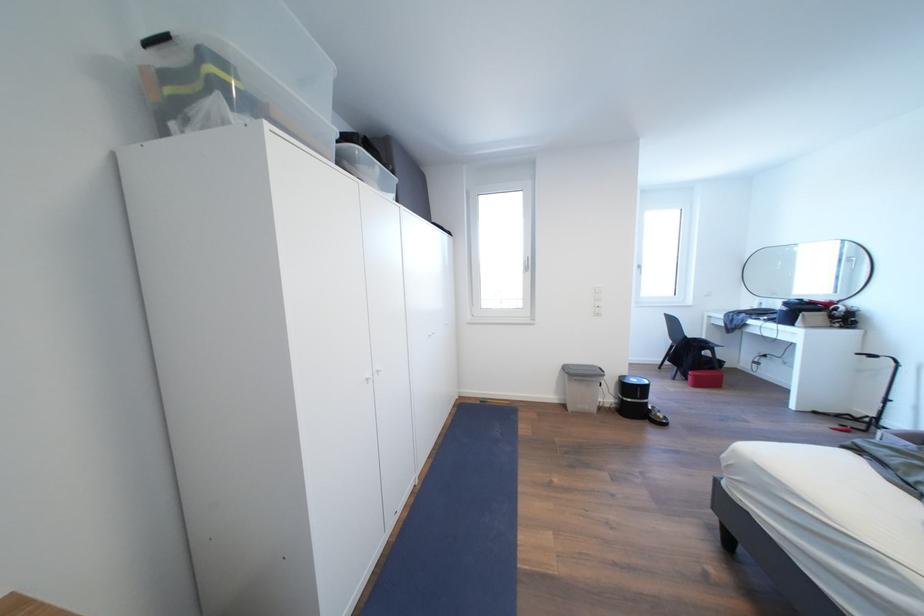
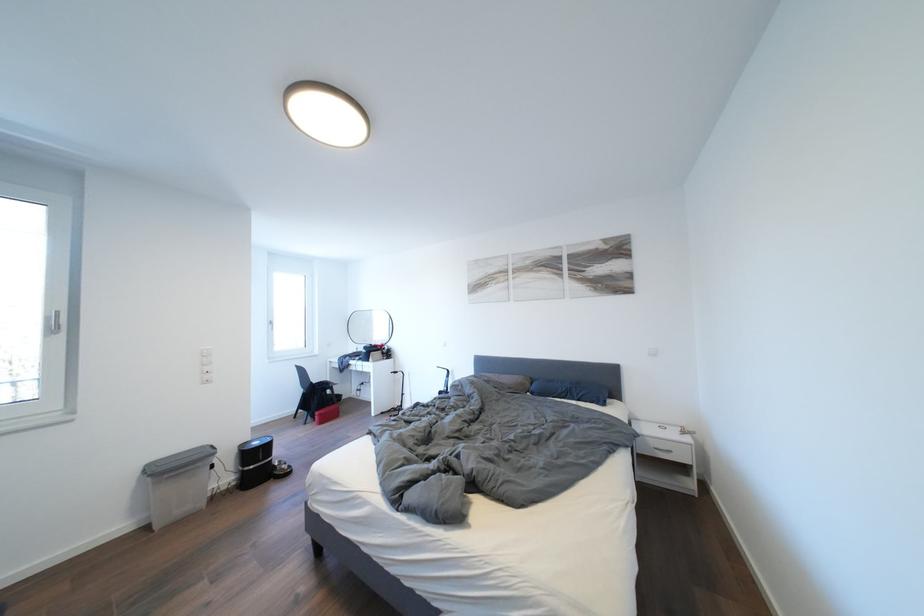
Locate, in the second image, the point that corresponds to point (532, 267) in the first image.

(56, 323)